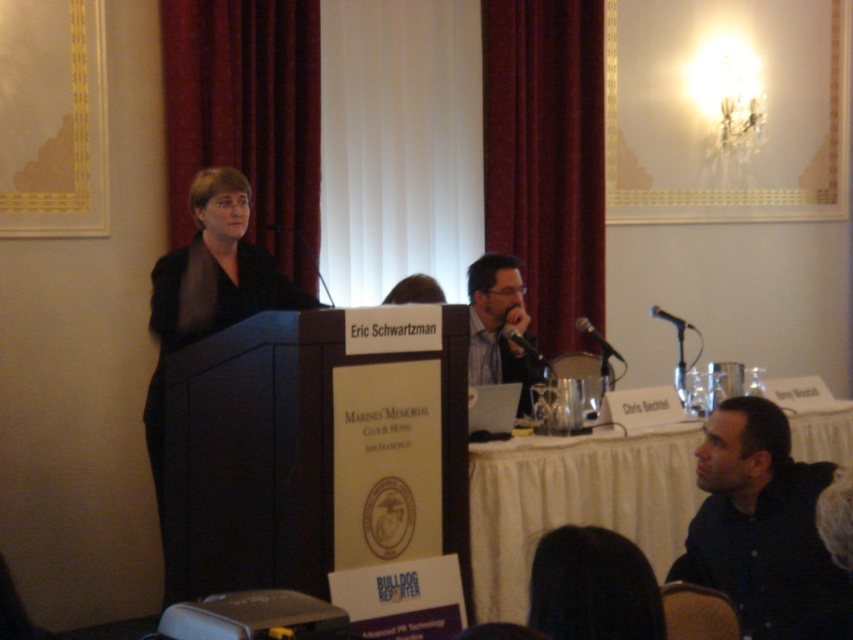
You are a stagehand who needs to move a 2.0 meter long extension cord from the black fabric at left to the burgundy velvet curtain at center. Can you place the cord end to end without bending it?

The distance between the burgundy velvet curtain at center and the black fabric at left is 2.18 meters. Since the extension cord is 2.0 meters long, it is shorter than the required distance. Therefore, the extension cord cannot reach from the black fabric at left to the burgundy velvet curtain at center without bending.

In the scene shown: You are an event organizer setting up for a presentation. You notice the burgundy velvet curtain at center and the black fabric at left. Which fabric is covering the other one?

The burgundy velvet curtain at center is positioned over the black fabric at left, meaning it is covering it.